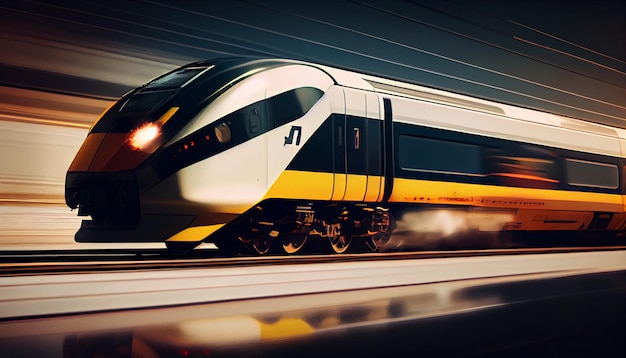
The image size is (626, 358). I want to click on black door, so click(354, 160).